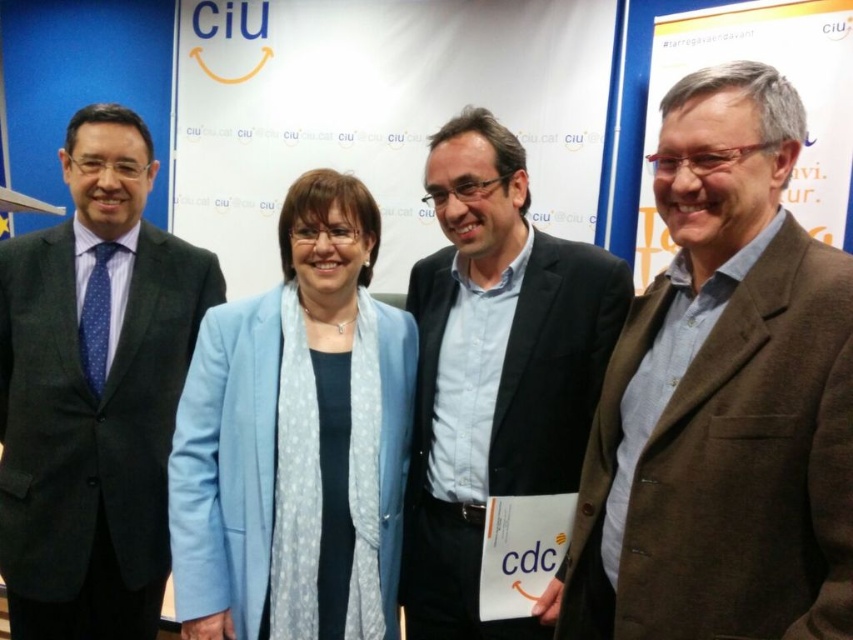
You are a photographer setting up for a group photo. You need to ensure there is enough space between the matte blue jacket at center and the dark gray suit at left for a professional look. The minimum recommended distance between subjects in such photos is 12 inches. Based on the scene, is the current spacing sufficient?

The matte blue jacket at center and dark gray suit at left are 14.49 inches apart from each other, which exceeds the minimum recommended distance of 12 inches. Therefore, the current spacing is sufficient for a professional look.

You are attending a professional event and see two people in the image. The first person is wearing a dark gray suit at left, and the second is wearing a blue shirt at center. Which one is standing to the left of the other?

The dark gray suit at left is positioned on the left side of blue shirt at center, so the person in the dark gray suit at left is standing to the left of the person in the blue shirt at center.